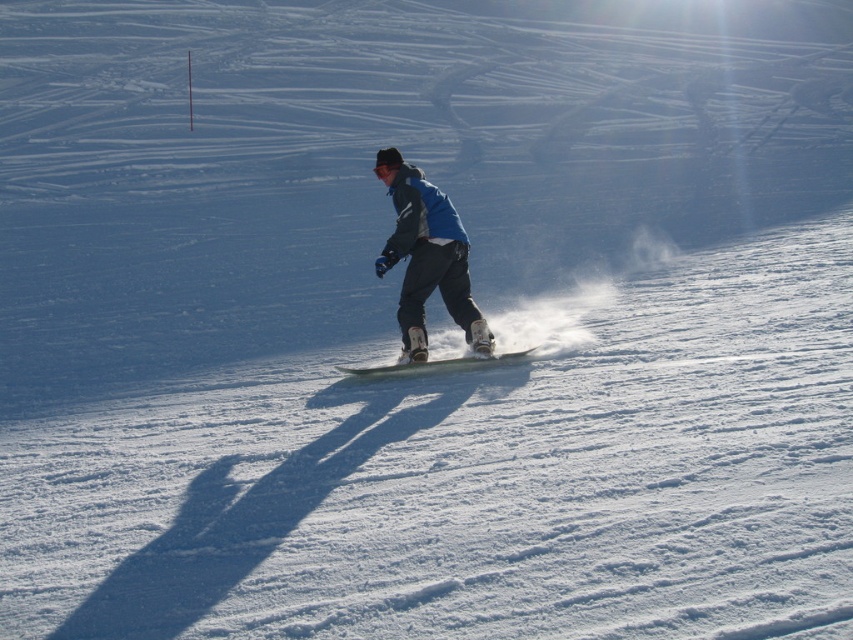
You are a photographer trying to capture the snowboarder and their board. Based on the scene, which object is narrower between the matte blue snowboarder at center and the white matte snowboard at center?

The matte blue snowboarder at center is thinner than the white matte snowboard at center, so the snowboarder is narrower.